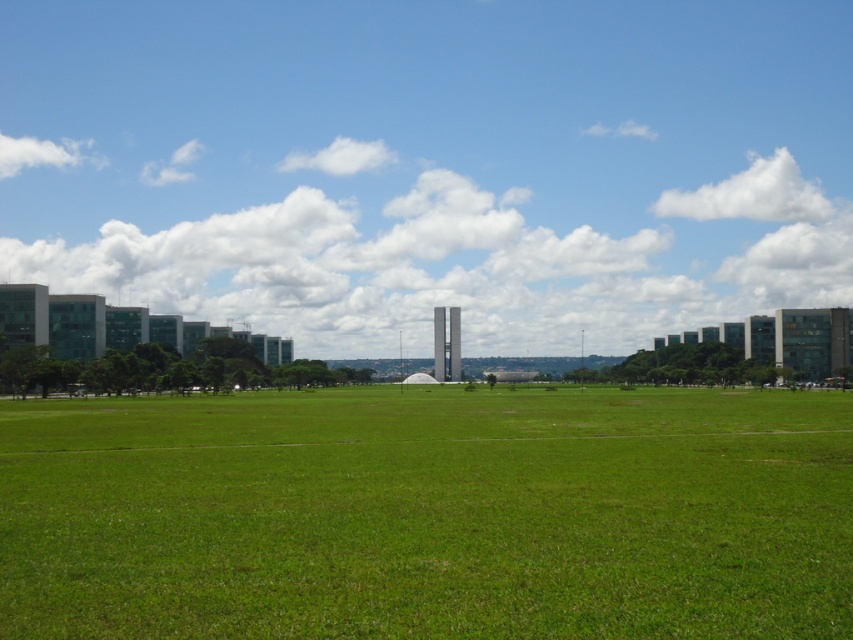
You are standing in a grassy field and see a point marked at coordinates (431,164). What is located at that point?

The transparent glass buildings at center are located at point (431,164).

You are standing at the origin point of a coordinate system where the image is mapped. The transparent glass buildings at center are located at point 0.258, 0.506. If you want to walk directly towards them from your current position at the origin, in which direction should you move?

You should move in the direction of the transparent glass buildings at center located at point (x=431, y=164), which is northeast from the origin.